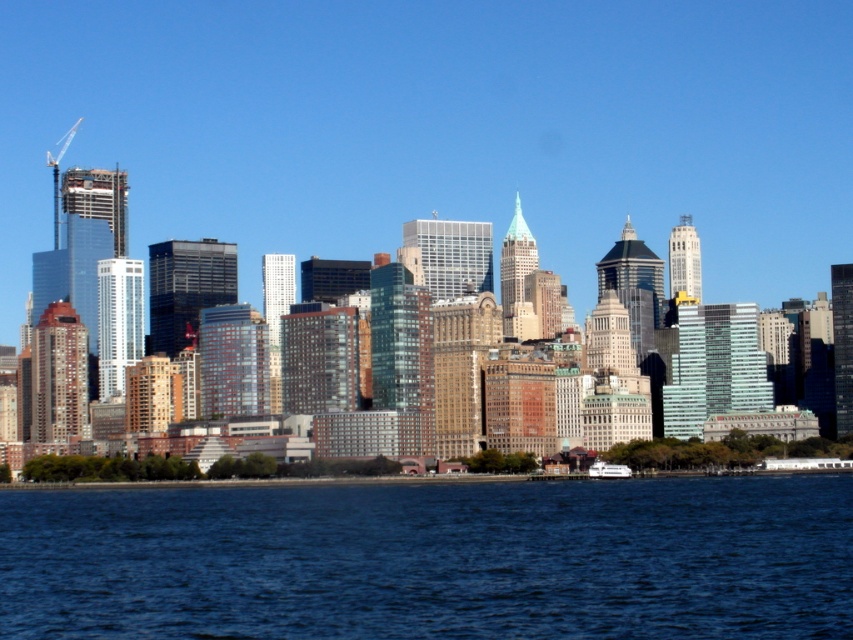
Question: Is blue liquid water at lower center wider than white glossy ferry at lower center?

Choices:
 (A) yes
 (B) no

Answer: (A)

Question: Which object is closer to the camera taking this photo?

Choices:
 (A) white glossy ferry at lower center
 (B) blue liquid water at lower center

Answer: (B)

Question: Is blue liquid water at lower center above white glossy ferry at lower center?

Choices:
 (A) no
 (B) yes

Answer: (A)

Question: Does blue liquid water at lower center have a smaller size compared to white glossy ferry at lower center?

Choices:
 (A) no
 (B) yes

Answer: (A)